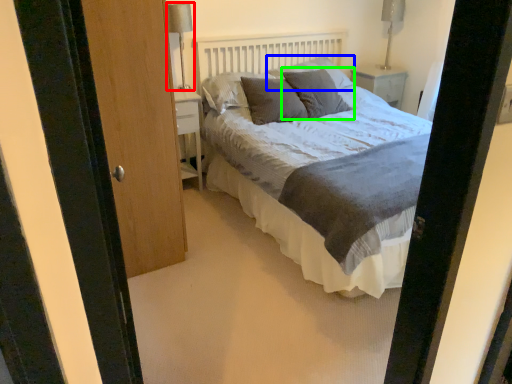
Question: Based on their relative distances, which object is farther from table lamp (highlighted by a red box)? Choose from pillow (highlighted by a blue box) and pillow (highlighted by a green box).

Choices:
 (A) pillow
 (B) pillow

Answer: (B)